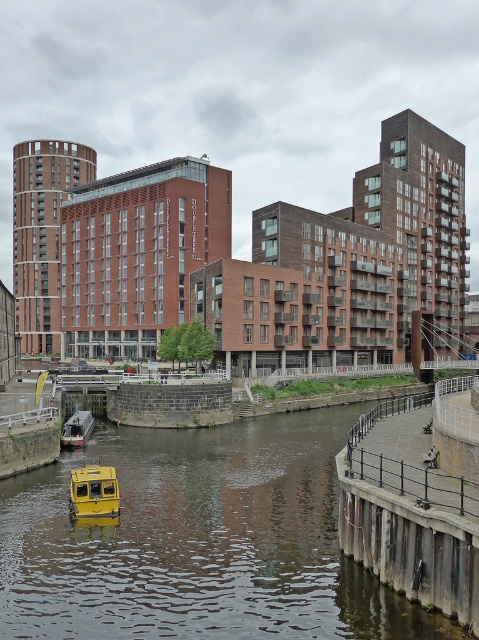
You are standing at the waterfront and want to reach a specific point marked as point (423, 572). If your maximum walking distance is 100 feet, can you reach it without exceeding your limit?

The point (423, 572) is 113.50 feet away from the viewer, which exceeds your maximum walking distance of 100 feet. You cannot reach it without exceeding your limit.

You are a photographer planning to capture the waterfront scene. You want to ensure both the yellow rubber boat at center and the yellow matte boat at lower center are clearly visible in your shot. Based on their positions, which boat should you focus on first to include both in the frame?

The yellow rubber boat at center should be focused on first since it is located below the yellow matte boat at lower center, allowing both to be captured in the frame by adjusting the camera angle upwards.

Based on the photo, you are standing on the concrete embankment on the right side of the waterfront scene. You see the point marked at coordinates (198, 541). What object is located at that point?

The point at coordinates (198, 541) corresponds to the yellow rubber boat at center.